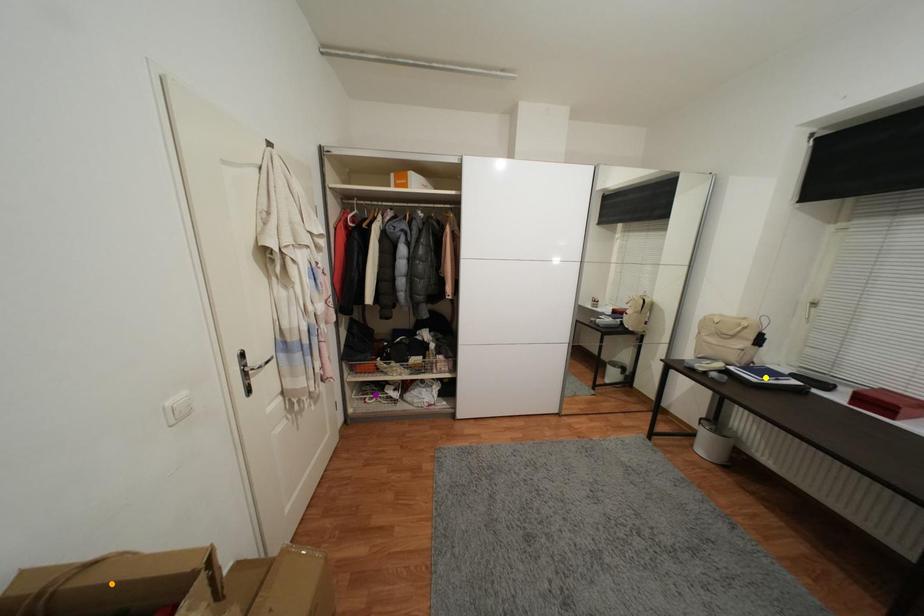
Order these from nearest to farthest:
yellow point
orange point
purple point

orange point → yellow point → purple point